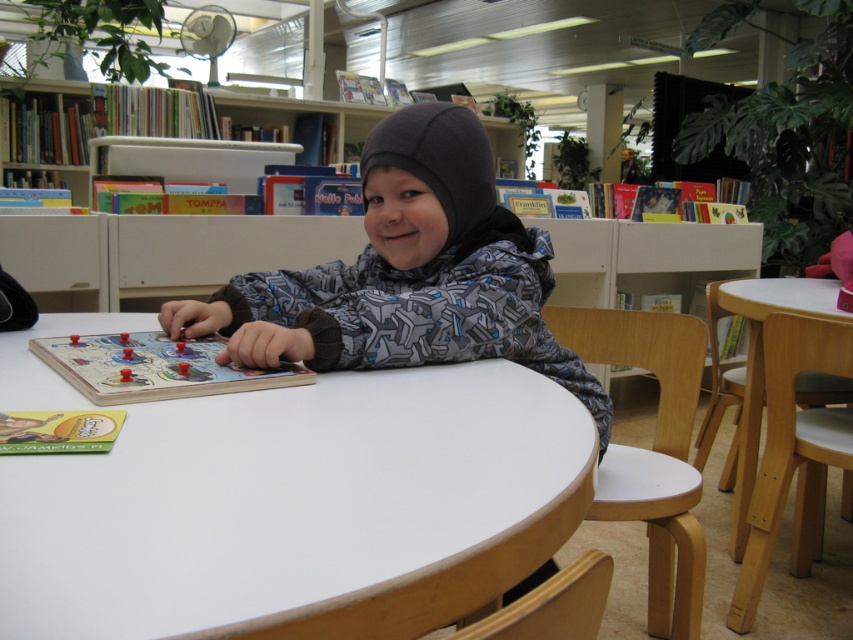
You are a librarian trying to locate two specific points in the library. The first point is at coordinates point (256, 465) and the second is at point (418, 170). From the perspective of someone standing at the entrance of the library, which point is closer to the front of the library?

Point (256, 465) is in front of point (418, 170), so from the entrance perspective, point (256, 465) is closer to the front of the library.

You are a parent in the library and want to retrieve a book from the white plastic bookshelf at upper center while your child is sitting in the gray fleece jacket at center. Can you walk to the bookshelf without needing to move the child?

The distance between the gray fleece jacket at center and the white plastic bookshelf at upper center is 4.18 feet, so yes, you can walk to the bookshelf without needing to move the child since the distance is sufficient for movement.